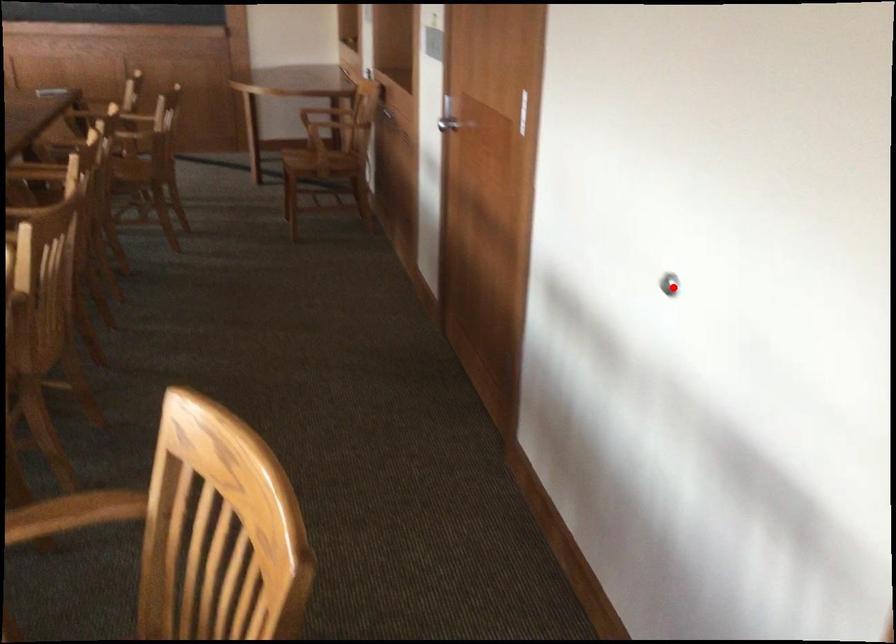
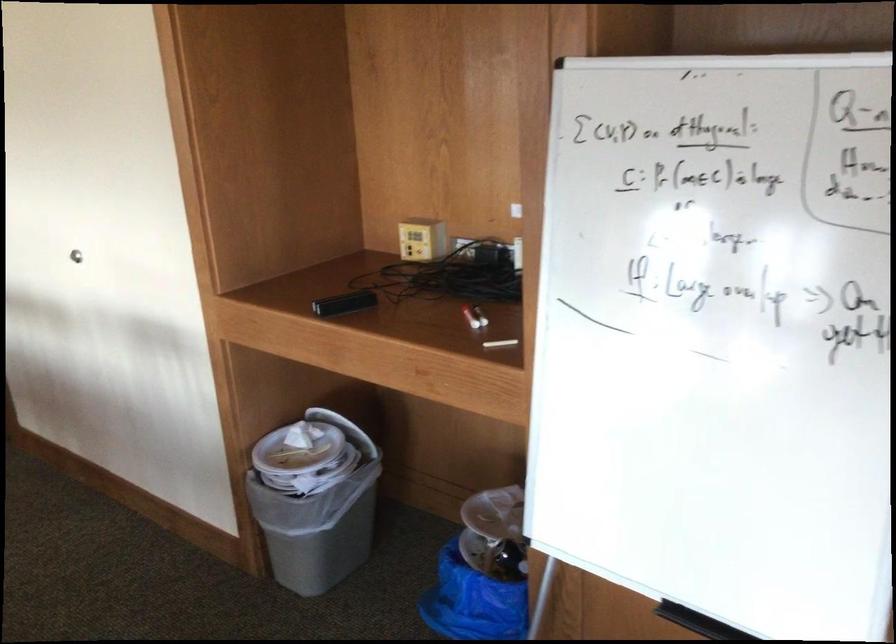
Locate, in the second image, the point that corresponds to the highlighted location in the first image.

(76, 254)